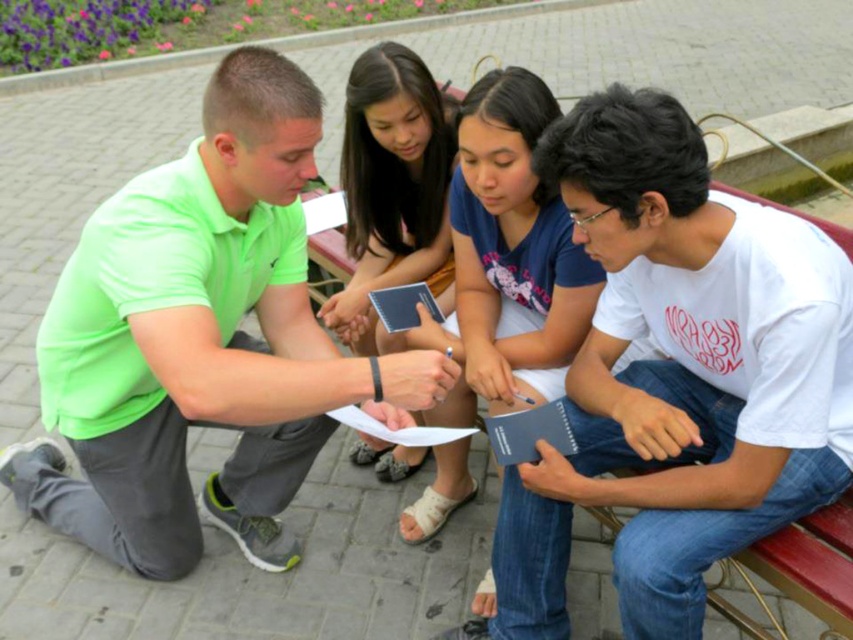
Can you confirm if white matte shirt at center is thinner than blue notebook at center?

No.

Who is taller, white matte shirt at center or blue notebook at center?

With more height is white matte shirt at center.

Between point (828, 339) and point (364, 81), which one is positioned in front?

Positioned in front is point (828, 339).

Where is `white matte shirt at center`? Image resolution: width=853 pixels, height=640 pixels. white matte shirt at center is located at coordinates pos(677,376).

Is white matte shirt at center below blue matte notebook at center?

Correct, white matte shirt at center is located below blue matte notebook at center.

Is the position of white matte shirt at center more distant than that of blue matte notebook at center?

No.

What do you see at coordinates (677, 376) in the screenshot? I see `white matte shirt at center` at bounding box center [677, 376].

You are a GUI agent. You are given a task and a screenshot of the screen. Output one action in this format:
    pyautogui.click(x=<x>, y=<y>)
    Task: Click on the white matte shirt at center
    Image resolution: width=853 pixels, height=640 pixels.
    Given the screenshot: What is the action you would take?
    pyautogui.click(x=677, y=376)

Does point (544, 275) come closer to viewer compared to point (370, 353)?

Yes.

Is blue matte notebook at center shorter than blue notebook at center?

No, blue matte notebook at center is not shorter than blue notebook at center.

Which is behind, point (496, 83) or point (351, 106)?

The point (351, 106) is more distant.

Image resolution: width=853 pixels, height=640 pixels. What are the coordinates of `blue matte notebook at center` in the screenshot? It's located at (506, 259).